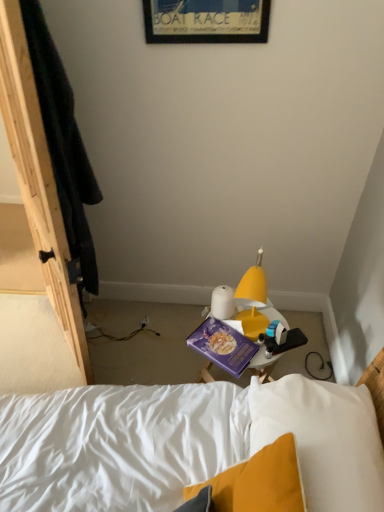
This screenshot has width=384, height=512. In order to click on vacant space situated above purple matte paperback book at center (from a real-world perspective) in this screenshot , I will do `click(221, 340)`.